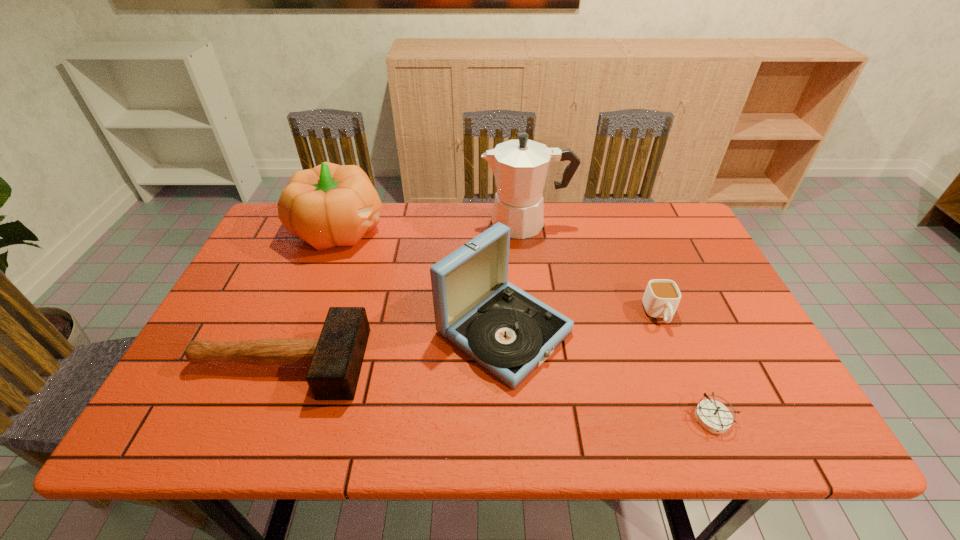
This screenshot has height=540, width=960. Identify the location of object that is at the far left corner. (330, 205).

Locate an element on the screen. object present at the near right corner is located at coordinates (713, 416).

Identify the location of free space at the far edge of the desktop. This screenshot has width=960, height=540. (449, 238).

At what (x,y) coordinates should I click in order to perform the action: click on vacant space at the left edge of the desktop. Please return your answer as a coordinate pair (x, y). Image resolution: width=960 pixels, height=540 pixels. Looking at the image, I should click on (253, 285).

I want to click on vacant space at the right edge of the desktop, so click(665, 278).

This screenshot has width=960, height=540. Identify the location of vacant position at the far right corner of the desktop. (647, 221).

Find the location of a particular element. This screenshot has width=960, height=540. unoccupied area between the cup and the coffeepot is located at coordinates (592, 269).

Find the location of a particular element. The image size is (960, 540). vacant area that lies between the tallest object and the compass is located at coordinates (619, 321).

You are a GUI agent. You are given a task and a screenshot of the screen. Output one action in this format:
    pyautogui.click(x=<x>, y=<y>)
    Task: Click on the free space between the phonograph record and the mallet
    The height and width of the screenshot is (540, 960).
    Given the screenshot: What is the action you would take?
    pyautogui.click(x=392, y=347)

At what (x,y) coordinates should I click in order to perform the action: click on empty location between the tallest object and the mallet. Please return your answer as a coordinate pair (x, y). The image size is (960, 540). Looking at the image, I should click on (402, 293).